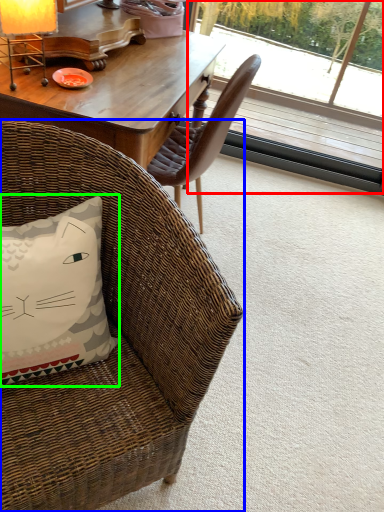
Question: Which object is the farthest from window screen (highlighted by a red box)? Choose among these: chair (highlighted by a blue box) or pillow (highlighted by a green box).

Choices:
 (A) chair
 (B) pillow

Answer: (B)